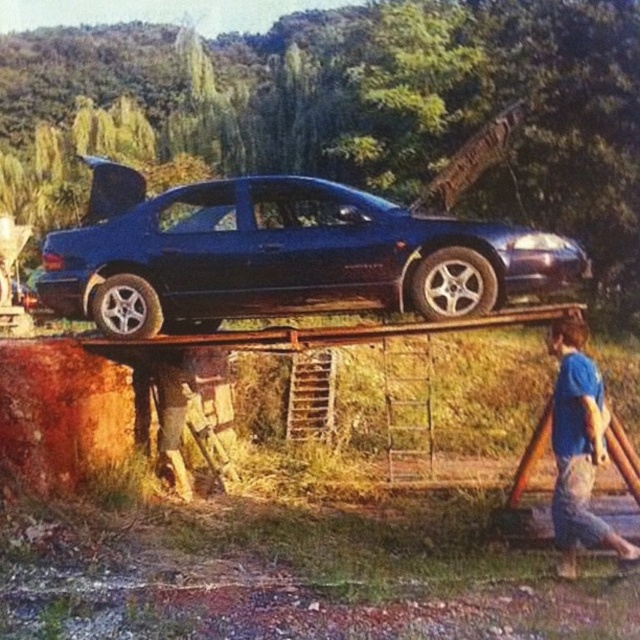
Does glossy blue sedan at center appear over blue cotton shirt at lower right?

Indeed, glossy blue sedan at center is positioned over blue cotton shirt at lower right.

Does point (202, 328) come in front of point (577, 467)?

No, it is behind (577, 467).

Identify the location of glossy blue sedan at center. (280, 256).